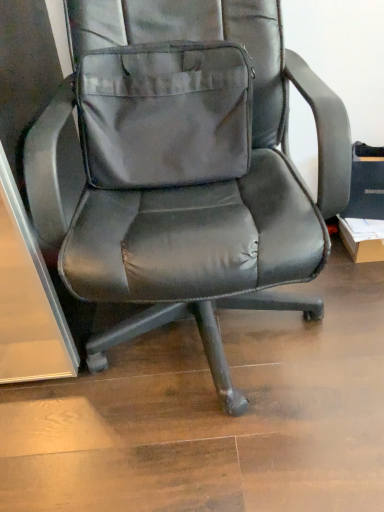
Question: Considering the positions of black leather office chair at center and gray fabric pocket at center in the image, is black leather office chair at center bigger or smaller than gray fabric pocket at center?

Choices:
 (A) small
 (B) big

Answer: (B)

Question: Is point (66, 278) positioned closer to the camera than point (144, 131)?

Choices:
 (A) closer
 (B) farther

Answer: (A)

Question: From a real-world perspective, is black leather office chair at center physically located above or below gray fabric pocket at center?

Choices:
 (A) above
 (B) below

Answer: (B)

Question: Would you say gray fabric pocket at center is to the left or to the right of black leather office chair at center in the picture?

Choices:
 (A) right
 (B) left

Answer: (B)

Question: Is point (114, 156) closer or farther from the camera than point (142, 291)?

Choices:
 (A) closer
 (B) farther

Answer: (B)

Question: From a real-world perspective, is gray fabric pocket at center physically located above or below black leather office chair at center?

Choices:
 (A) below
 (B) above

Answer: (B)

Question: In terms of size, does gray fabric pocket at center appear bigger or smaller than black leather office chair at center?

Choices:
 (A) small
 (B) big

Answer: (A)